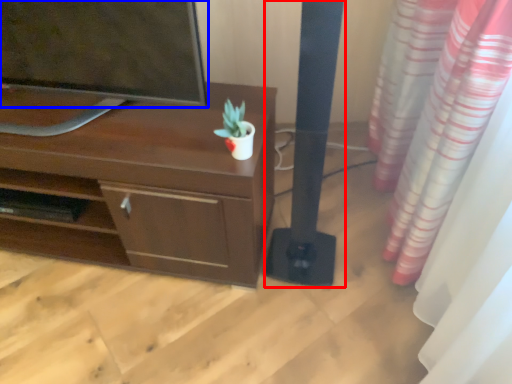
Question: Which object appears closest to the camera in this image, pillar (highlighted by a red box) or television (highlighted by a blue box)?

Choices:
 (A) pillar
 (B) television

Answer: (A)